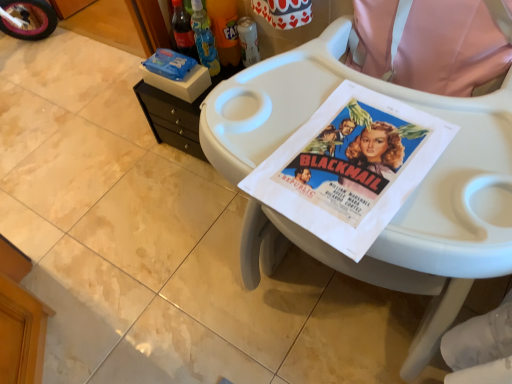
This screenshot has width=512, height=384. Find the location of `white glossy tile at lower left`. white glossy tile at lower left is located at coordinates (83, 308).

This screenshot has height=384, width=512. Describe the element at coordinates (225, 30) in the screenshot. I see `translucent plastic bottle at upper center, which appears as the second bottle when viewed from the right` at that location.

This screenshot has height=384, width=512. What do you see at coordinates (248, 40) in the screenshot?
I see `metallic can at center, the first bottle in the right-to-left sequence` at bounding box center [248, 40].

Where is `white glossy tile at lower left`? The image size is (512, 384). white glossy tile at lower left is located at coordinates (83, 308).

How different are the orientations of metallic can at center, the first bottle in the right-to-left sequence, and white glossy tile at lower left in degrees?

178 degrees.

Consider the image. Can you confirm if metallic can at center, acting as the 3th bottle starting from the left, is thinner than white glossy tile at lower left?

Yes, metallic can at center, acting as the 3th bottle starting from the left, is thinner than white glossy tile at lower left.

Locate an element on the screen. bottle that is the 1st object above the white glossy tile at lower left (from a real-world perspective) is located at coordinates (248, 40).

Considering the relative sizes of metallic can at center, the first bottle in the right-to-left sequence, and white glossy tile at lower left in the image provided, is metallic can at center, the first bottle in the right-to-left sequence, bigger than white glossy tile at lower left?

Incorrect, metallic can at center, the first bottle in the right-to-left sequence, is not larger than white glossy tile at lower left.

In the scene shown: From the image's perspective, which one is positioned lower, black plastic changing table at upper left or white plastic feeding chair at center?

white plastic feeding chair at center, from the image's perspective.

From a real-world perspective, is black plastic changing table at upper left located beneath white plastic feeding chair at center?

Yes.

What's the angular difference between black plastic changing table at upper left and white plastic feeding chair at center's facing directions?

There is a 0.213-degree angle between the facing directions of black plastic changing table at upper left and white plastic feeding chair at center.

Measure the distance from black plastic changing table at upper left to white plastic feeding chair at center.

They are 32.20 inches apart.

Considering the relative positions of translucent plastic bottle at upper center, the 2th bottle positioned from the left, and white glossy tile at lower left in the image provided, is translucent plastic bottle at upper center, the 2th bottle positioned from the left, to the left or to the right of white glossy tile at lower left?

translucent plastic bottle at upper center, the 2th bottle positioned from the left, is positioned on white glossy tile at lower left's right side.

From the image's perspective, is translucent plastic bottle at upper center, which appears as the second bottle when viewed from the right, on top of white glossy tile at lower left?

Yes.

Is white glossy tile at lower left inside translucent plastic bottle at upper center, the 2th bottle positioned from the left?

No, translucent plastic bottle at upper center, the 2th bottle positioned from the left, does not contain white glossy tile at lower left.

Measure the distance between translucent plastic bottle at upper center, which appears as the second bottle when viewed from the right, and white glossy tile at lower left.

translucent plastic bottle at upper center, which appears as the second bottle when viewed from the right, is 36.67 inches from white glossy tile at lower left.

Does metallic can at center, the first bottle in the right-to-left sequence, have a greater height compared to translucent plastic bottle at upper center, the first bottle from the left?

Incorrect, the height of metallic can at center, the first bottle in the right-to-left sequence, is not larger of that of translucent plastic bottle at upper center, the first bottle from the left.

Would you say metallic can at center, the first bottle in the right-to-left sequence, is inside or outside translucent plastic bottle at upper center, the 3th bottle from the right?

The correct answer is: outside.

This screenshot has height=384, width=512. Find the location of `the 2nd bottle to the right of the translucent plastic bottle at upper center, the first bottle from the left, counting from the anchor's position`. the 2nd bottle to the right of the translucent plastic bottle at upper center, the first bottle from the left, counting from the anchor's position is located at coordinates (248, 40).

Between point (254, 60) and point (204, 27), which one is positioned behind?

The point (254, 60) is more distant.

From the image's perspective, is white glossy tile at lower left above or below translucent plastic bottle at upper center, which appears as the second bottle when viewed from the right?

white glossy tile at lower left is situated lower than translucent plastic bottle at upper center, which appears as the second bottle when viewed from the right, in the image.

Which is correct: white glossy tile at lower left is inside translucent plastic bottle at upper center, the 2th bottle positioned from the left, or outside of it?

white glossy tile at lower left exists outside the volume of translucent plastic bottle at upper center, the 2th bottle positioned from the left.

Could you measure the distance between white glossy tile at lower left and translucent plastic bottle at upper center, which appears as the second bottle when viewed from the right?

white glossy tile at lower left and translucent plastic bottle at upper center, which appears as the second bottle when viewed from the right, are 36.67 inches apart.

Could you tell me if white glossy tile at lower left is turned towards translucent plastic bottle at upper center, which appears as the second bottle when viewed from the right?

Yes, white glossy tile at lower left faces towards translucent plastic bottle at upper center, which appears as the second bottle when viewed from the right.

From the image's perspective, between white glossy tile at lower left and translucent plastic bottle at upper center, the 3th bottle from the right, who is located below?

white glossy tile at lower left appears lower in the image.

Is point (80, 305) less distant than point (209, 66)?

Yes, point (80, 305) is in front of point (209, 66).

In the scene shown: Is white glossy tile at lower left located outside translucent plastic bottle at upper center, the 3th bottle from the right?

white glossy tile at lower left is positioned outside translucent plastic bottle at upper center, the 3th bottle from the right.

How far apart are white glossy tile at lower left and translucent plastic bottle at upper center, the first bottle from the left?

white glossy tile at lower left and translucent plastic bottle at upper center, the first bottle from the left, are 34.74 inches apart from each other.

Based on the photo, from the image's perspective, does white plastic feeding chair at center appear lower than metallic can at center, acting as the 3th bottle starting from the left?

Correct, white plastic feeding chair at center appears lower than metallic can at center, acting as the 3th bottle starting from the left, in the image.

Which is more distant, (450, 273) or (249, 30)?

The point (249, 30) is farther from the camera.

At what (x,y) coordinates should I click in order to perform the action: click on feeding chair above the metallic can at center, acting as the 3th bottle starting from the left (from a real-world perspective). Please return your answer as a coordinate pair (x, y). Looking at the image, I should click on coord(404,203).

Can you confirm if white plastic feeding chair at center is taller than metallic can at center, acting as the 3th bottle starting from the left?

Yes.

At what (x,y) coordinates should I click in order to perform the action: click on tile beneath the metallic can at center, acting as the 3th bottle starting from the left (from a real-world perspective). Please return your answer as a coordinate pair (x, y). The image size is (512, 384). Looking at the image, I should click on (83, 308).

I want to click on changing table on the left of white plastic feeding chair at center, so click(x=177, y=114).

Which object lies further to the anchor point metallic can at center, acting as the 3th bottle starting from the left, black plastic changing table at upper left or white plastic feeding chair at center?

white plastic feeding chair at center.

Estimate the real-world distances between objects in this image. Which object is closer to white plastic feeding chair at center, black plastic changing table at upper left or translucent plastic bottle at upper center, the 3th bottle from the right?

translucent plastic bottle at upper center, the 3th bottle from the right, lies closer to white plastic feeding chair at center than the other object.

When comparing their distances from metallic can at center, acting as the 3th bottle starting from the left, does translucent plastic bottle at upper center, which appears as the second bottle when viewed from the right, or translucent plastic bottle at upper center, the first bottle from the left, seem further?

translucent plastic bottle at upper center, the first bottle from the left, is positioned further to the anchor metallic can at center, acting as the 3th bottle starting from the left.

Estimate the real-world distances between objects in this image. Which object is further from white plastic feeding chair at center, metallic can at center, acting as the 3th bottle starting from the left, or translucent plastic bottle at upper center, the first bottle from the left?

translucent plastic bottle at upper center, the first bottle from the left, is positioned further to the anchor white plastic feeding chair at center.

From the image, which object appears to be nearer to translucent plastic bottle at upper center, the 3th bottle from the right, white plastic feeding chair at center or metallic can at center, acting as the 3th bottle starting from the left?

Based on the image, metallic can at center, acting as the 3th bottle starting from the left, appears to be nearer to translucent plastic bottle at upper center, the 3th bottle from the right.

From the image, which object appears to be farther from white glossy tile at lower left, translucent plastic bottle at upper center, the first bottle from the left, or black plastic changing table at upper left?

translucent plastic bottle at upper center, the first bottle from the left, lies further to white glossy tile at lower left than the other object.

In the scene shown: From the image, which object appears to be farther from translucent plastic bottle at upper center, the 2th bottle positioned from the left, metallic can at center, acting as the 3th bottle starting from the left, or white plastic feeding chair at center?

white plastic feeding chair at center is positioned further to the anchor translucent plastic bottle at upper center, the 2th bottle positioned from the left.

Looking at the image, which one is located further to metallic can at center, the first bottle in the right-to-left sequence, white plastic feeding chair at center or white glossy tile at lower left?

white glossy tile at lower left lies further to metallic can at center, the first bottle in the right-to-left sequence, than the other object.

Locate an element on the screen. The height and width of the screenshot is (384, 512). bottle between translucent plastic bottle at upper center, the 3th bottle from the right, and white glossy tile at lower left from top to bottom is located at coordinates (248, 40).

Find the location of a particular element. This screenshot has height=384, width=512. tile between white plastic feeding chair at center and metallic can at center, acting as the 3th bottle starting from the left, from front to back is located at coordinates (83, 308).

This screenshot has width=512, height=384. I want to click on bottle between white plastic feeding chair at center and translucent plastic bottle at upper center, the first bottle from the left, along the z-axis, so click(x=225, y=30).

Find the location of a particular element. This screenshot has height=384, width=512. changing table between metallic can at center, acting as the 3th bottle starting from the left, and white glossy tile at lower left from top to bottom is located at coordinates (177, 114).